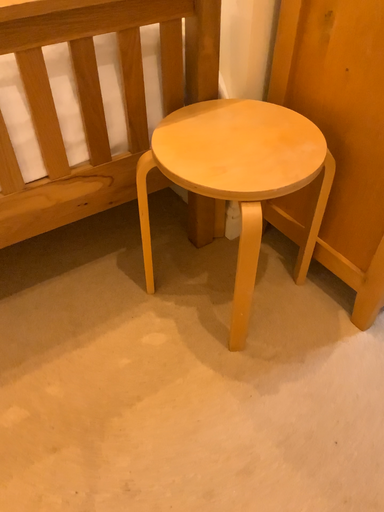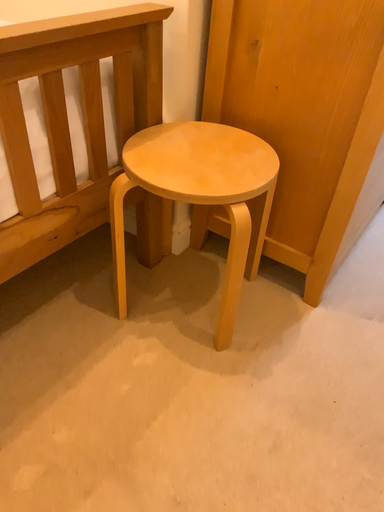
Question: How did the camera likely rotate when shooting the video?

Choices:
 (A) rotated downward
 (B) rotated upward

Answer: (B)